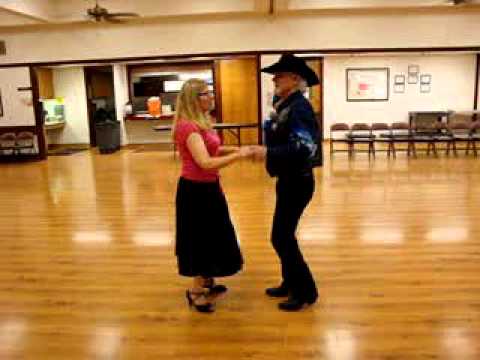
You are a GUI agent. You are given a task and a screenshot of the screen. Output one action in this format:
    pyautogui.click(x=<x>, y=<y>)
    Task: Click on the fan
    The image size is (480, 360).
    Given the screenshot: What is the action you would take?
    pyautogui.click(x=100, y=10)